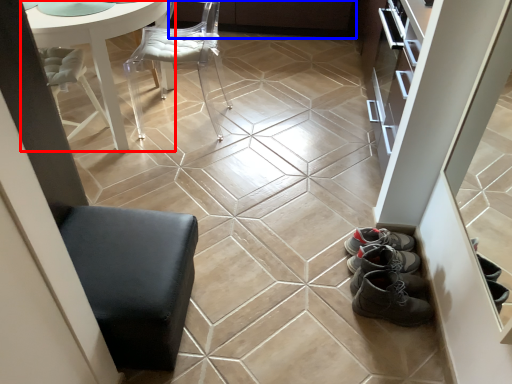
Question: Which object is closer to the camera taking this photo, table (highlighted by a red box) or cabinetry (highlighted by a blue box)?

Choices:
 (A) table
 (B) cabinetry

Answer: (A)